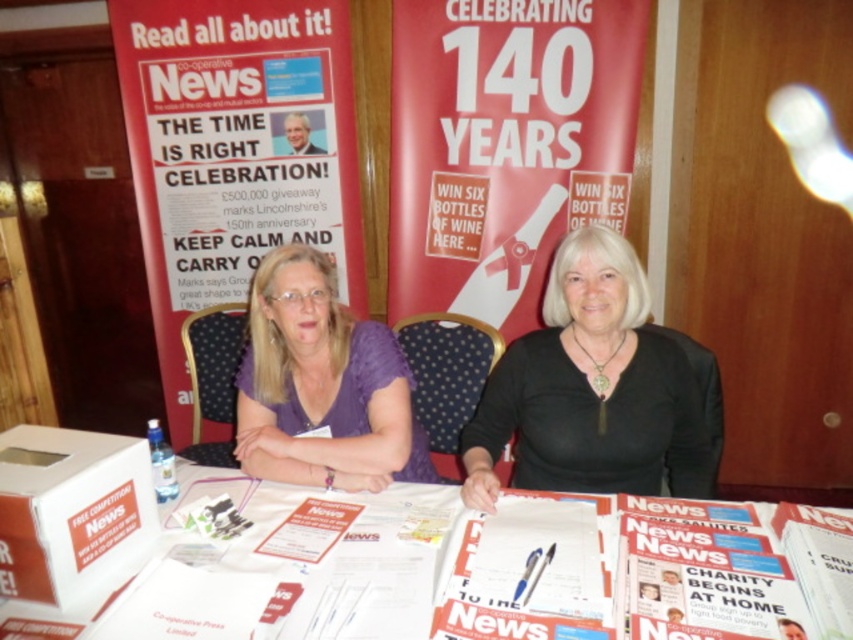
From the picture: Is red matte poster at center shorter than white glossy paper at center?

No, red matte poster at center is not shorter than white glossy paper at center.

Can you confirm if red matte poster at center is positioned to the left of white glossy paper at center?

In fact, red matte poster at center is to the right of white glossy paper at center.

Is point (480, 230) more distant than point (598, 621)?

Yes, it is behind point (598, 621).

Find the location of a particular element. red matte poster at center is located at coordinates (505, 145).

Measure the distance between white paper at center and white glossy magazine at center.

The distance of white paper at center from white glossy magazine at center is 4.95 inches.

Find the location of a particular element. This screenshot has height=640, width=853. white paper at center is located at coordinates (480, 570).

Locate an element on the screen. This screenshot has height=640, width=853. white paper at center is located at coordinates (480, 570).

Who is shorter, red cardboard poster at upper left or white glossy paper at center?

white glossy paper at center is shorter.

Is red cardboard poster at upper left below white glossy paper at center?

Actually, red cardboard poster at upper left is above white glossy paper at center.

Does point (277, 83) come behind point (608, 602)?

Yes, it is.

You are a GUI agent. You are given a task and a screenshot of the screen. Output one action in this format:
    pyautogui.click(x=<x>, y=<y>)
    Task: Click on the red cardboard poster at upper left
    
    Given the screenshot: What is the action you would take?
    pyautogui.click(x=235, y=152)